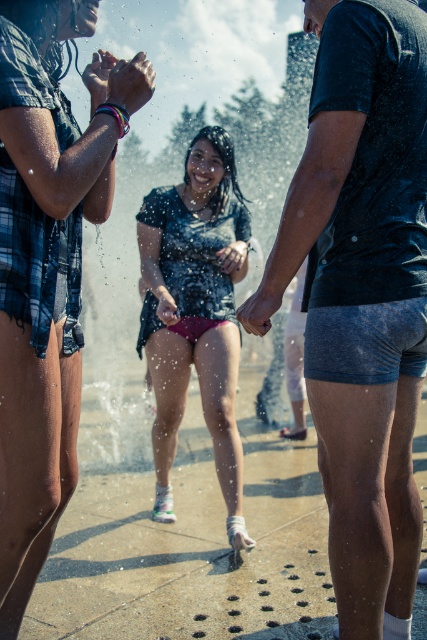
Question: Can you confirm if matte black shorts at center is wider than matte pink shorts at center?

Choices:
 (A) yes
 (B) no

Answer: (B)

Question: Is dark blue textured shorts at center to the left of matte black shorts at center from the viewer's perspective?

Choices:
 (A) yes
 (B) no

Answer: (B)

Question: Does dark blue textured shorts at center appear over matte pink shorts at center?

Choices:
 (A) no
 (B) yes

Answer: (B)

Question: Which point appears farthest from the camera in this image?

Choices:
 (A) (388, 468)
 (B) (23, 408)
 (C) (207, 156)

Answer: (C)

Question: Which of the following is the closest to the observer?

Choices:
 (A) (169, 273)
 (B) (391, 195)
 (C) (41, 60)

Answer: (B)

Question: Based on their relative distances, which object is nearer to the matte black shorts at center?

Choices:
 (A) matte pink shorts at center
 (B) dark blue textured shorts at center

Answer: (B)